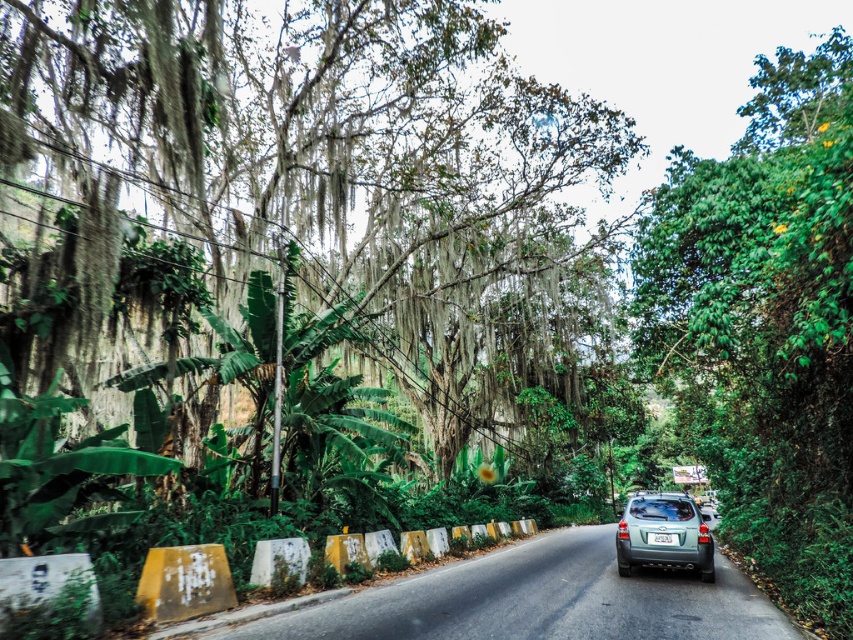
Between green leafy tree at right and yellow painted concrete barriers at lower center, which one is positioned lower?

yellow painted concrete barriers at lower center

Can you confirm if green leafy tree at right is bigger than yellow painted concrete barriers at lower center?

Indeed, green leafy tree at right has a larger size compared to yellow painted concrete barriers at lower center.

This screenshot has width=853, height=640. In order to click on green leafy tree at right in this screenshot , I will do `click(764, 323)`.

Identify the location of green leafy tree at right. This screenshot has height=640, width=853. (764, 323).

Does green leafy tree at right have a smaller size compared to slate metallic suv at center?

Incorrect, green leafy tree at right is not smaller in size than slate metallic suv at center.

Does green leafy tree at right appear on the right side of slate metallic suv at center?

No, green leafy tree at right is not to the right of slate metallic suv at center.

Identify the location of green leafy tree at right. (764, 323).

The width and height of the screenshot is (853, 640). I want to click on green leafy tree at right, so click(764, 323).

Between yellow painted concrete barriers at lower center and white plastic license plate at center, which one appears on the right side from the viewer's perspective?

white plastic license plate at center

Does yellow painted concrete barriers at lower center appear on the right side of white plastic license plate at center?

Incorrect, yellow painted concrete barriers at lower center is not on the right side of white plastic license plate at center.

Which is behind, point (125, 618) or point (666, 536)?

The point (666, 536) is more distant.

This screenshot has width=853, height=640. Find the location of `yellow painted concrete barriers at lower center`. yellow painted concrete barriers at lower center is located at coordinates (x=57, y=588).